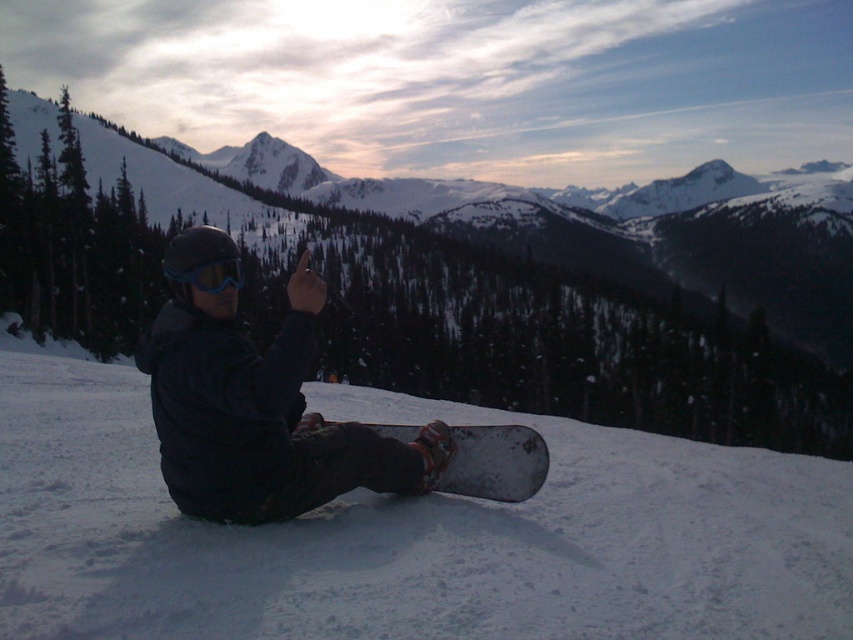
You are a photographer trying to capture the person in the scene. If you want to focus on the matte blue goggles at center without the dark gray matte snowboard at lower center blocking the view, where should you position yourself relative to the snowboard?

You should position yourself behind the dark gray matte snowboard at lower center so that the matte blue goggles at center is visible in front of you, as the goggles are behind the snowboard.

You are a photographer trying to capture the matte black snowboarder at center and the matte blue goggles at center in a single shot. Which object should you zoom in on to ensure both are clearly visible in your photo?

The matte black snowboarder at center has a smaller size compared to matte blue goggles at center. To ensure both are clearly visible, you should zoom in on the matte blue goggles at center since it is larger and easier to focus on while keeping the snowboarder in frame.

You are a photographer trying to capture a closeup of the dark gray matte snowboard at lower center and the matte blue goggles at center. Since you want to focus on both objects equally, which one should you adjust your camera angle to lower to ensure both are in focus?

The dark gray matte snowboard at lower center has a lesser height compared to the matte blue goggles at center, so you should lower your camera angle to focus on the snowboard first and then adjust to include the goggles.